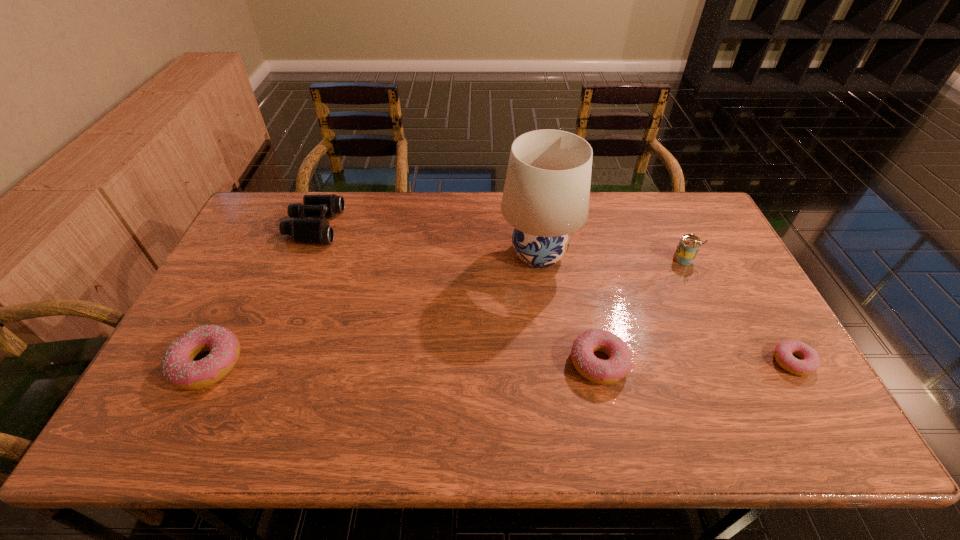
In order to click on free region located on the left of the second tallest doughnut in this screenshot , I will do (432, 362).

This screenshot has height=540, width=960. Identify the location of free space located 0.370m on the left of the shortest object. (628, 362).

I want to click on blank space located on the front-facing side of the third tallest object, so click(413, 226).

This screenshot has height=540, width=960. What are the coordinates of `vacant position located on the front-facing side of the lampshade` in the screenshot? It's located at (392, 254).

Image resolution: width=960 pixels, height=540 pixels. I want to click on vacant space located 0.070m on the front-facing side of the lampshade, so click(477, 254).

I want to click on vacant space located on the front-facing side of the lampshade, so click(395, 254).

I want to click on free region located on the front of the fifth object from left to right, so click(x=714, y=323).

The width and height of the screenshot is (960, 540). What are the coordinates of `binoculars that is at the far edge` in the screenshot? It's located at (309, 231).

Locate an element on the screen. lampshade that is at the far edge is located at coordinates (546, 195).

Where is `doughnut that is at the left edge`? The width and height of the screenshot is (960, 540). doughnut that is at the left edge is located at coordinates (178, 366).